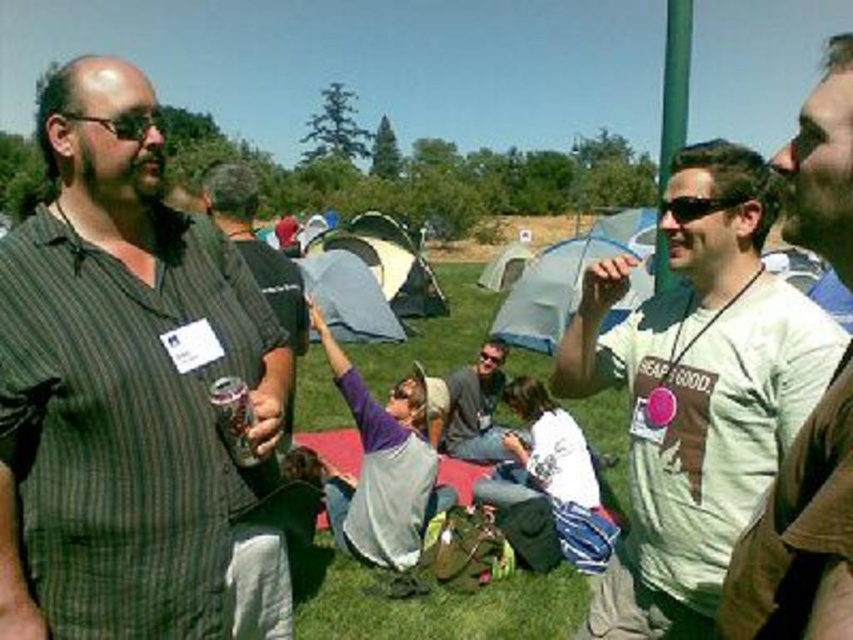
Question: Is white matte t-shirt at center positioned before green grass at center?

Choices:
 (A) yes
 (B) no

Answer: (A)

Question: Which point appears farthest from the camera in this image?

Choices:
 (A) (453, 420)
 (B) (498, 276)
 (C) (137, 128)

Answer: (B)

Question: Which of the following is the closest to the observer?

Choices:
 (A) black plastic glasses at left
 (B) gray cotton shirt at center
 (C) light green t-shirt at center

Answer: (C)

Question: Where is white matte t-shirt at center located in relation to black plastic glasses at left in the image?

Choices:
 (A) left
 (B) right

Answer: (B)

Question: Does striped cotton shirt at left appear on the left side of black plastic glasses at left?

Choices:
 (A) yes
 (B) no

Answer: (B)

Question: Which object is the farthest from the green grass at center?

Choices:
 (A) striped fabric shirt at center
 (B) white matte t-shirt at center
 (C) light green t-shirt at center
 (D) striped cotton shirt at left

Answer: (C)